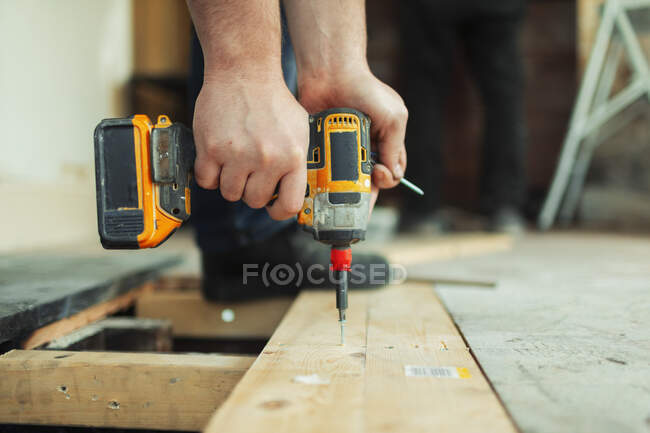
Locate an element on the screen. This screenshot has height=433, width=650. wood plank is located at coordinates (351, 413).